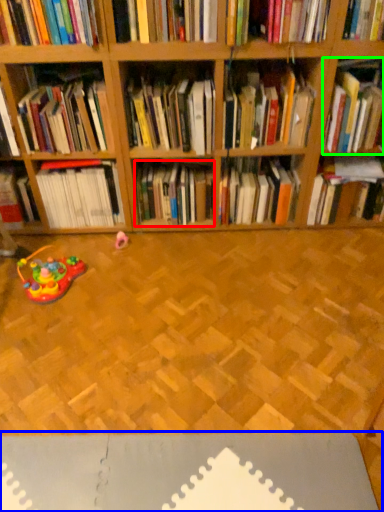
Question: Which object is the closest to the book (highlighted by a red box)? Choose among these: surface (highlighted by a blue box) or book (highlighted by a green box).

Choices:
 (A) surface
 (B) book

Answer: (B)